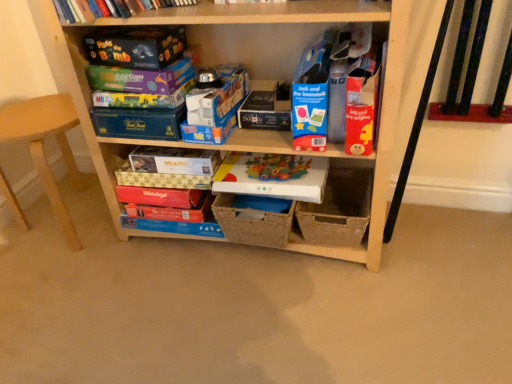
Find the location of `vacant space in front of wooden shelf at center`. vacant space in front of wooden shelf at center is located at coordinates (279, 332).